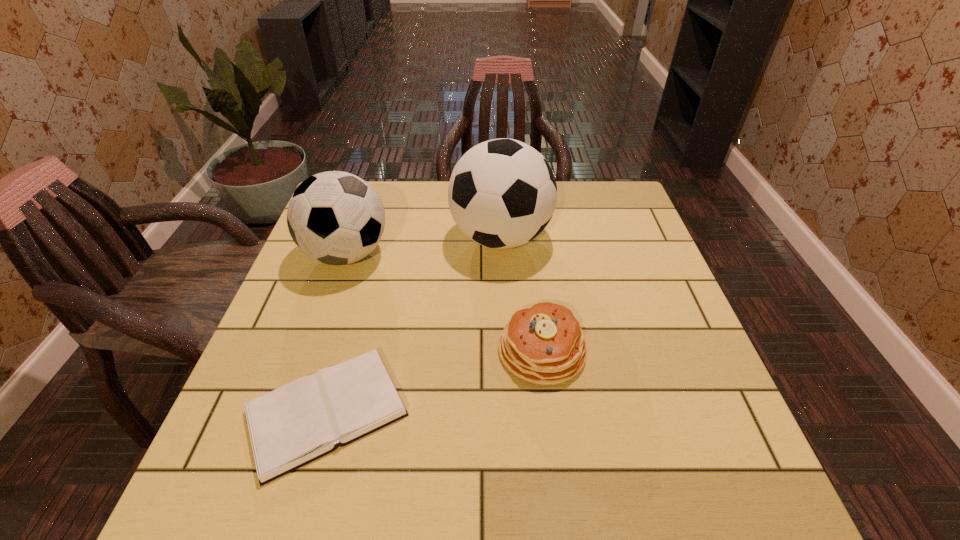
What are the coordinates of `the tallest object` in the screenshot? It's located at (502, 193).

Identify the location of the right soccer ball. (502, 193).

Locate an element on the screen. This screenshot has height=540, width=960. the left soccer ball is located at coordinates (335, 217).

The height and width of the screenshot is (540, 960). I want to click on the second tallest object, so click(335, 217).

The width and height of the screenshot is (960, 540). I want to click on the second shortest object, so click(x=543, y=344).

Identify the location of hardback book. The height and width of the screenshot is (540, 960). (303, 420).

This screenshot has width=960, height=540. What are the coordinates of `free space located 0.130m on the right of the taller soccer ball` in the screenshot? It's located at (596, 238).

Locate an element on the screen. Image resolution: width=960 pixels, height=540 pixels. free location located 0.310m on the main logo of the third shortest object is located at coordinates (505, 254).

Where is `vacant space located on the left of the pancake`? vacant space located on the left of the pancake is located at coordinates (402, 350).

What are the coordinates of `vacant space located on the right of the shortest object` in the screenshot? It's located at (476, 412).